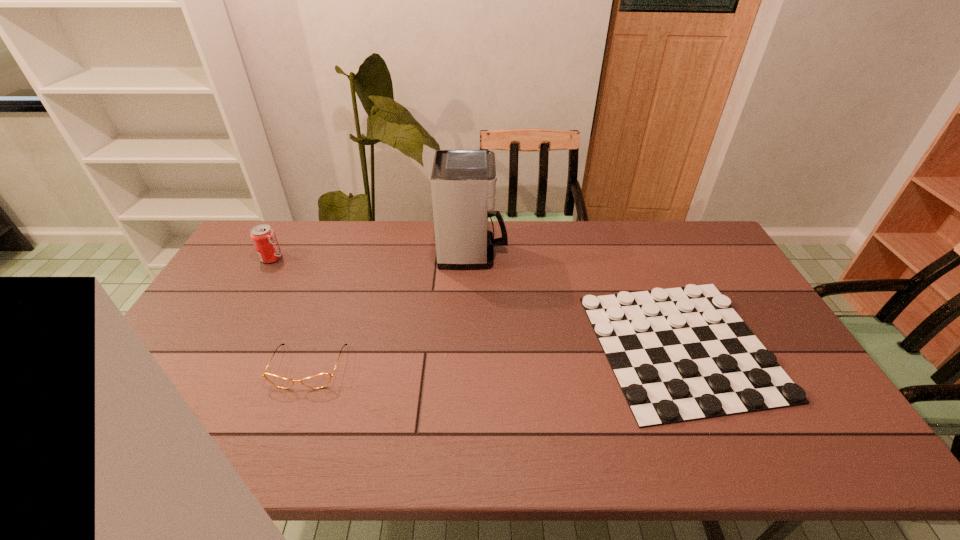
The height and width of the screenshot is (540, 960). I want to click on free location at the near edge, so click(x=367, y=436).

At what (x,y) coordinates should I click in order to perform the action: click on vacant point at the far left corner. Please return your answer as a coordinate pair (x, y). The image size is (960, 540). Looking at the image, I should click on click(251, 232).

The image size is (960, 540). In order to click on vacant space at the far right corner of the desktop in this screenshot , I will do `click(708, 252)`.

At what (x,y) coordinates should I click in order to perform the action: click on free location at the near right corner of the desktop. Please return your answer as a coordinate pair (x, y). This screenshot has width=960, height=540. Looking at the image, I should click on (780, 444).

Where is `free space between the third tallest object and the soda can`? The image size is (960, 540). free space between the third tallest object and the soda can is located at coordinates (290, 313).

At what (x,y) coordinates should I click in order to perform the action: click on free space between the third object from right to left and the rightmost object. Please return your answer as a coordinate pair (x, y). The height and width of the screenshot is (540, 960). Looking at the image, I should click on (494, 356).

Find the location of a particular element. The image size is (960, 540). vacant space that is in between the shortest object and the third object from right to left is located at coordinates (494, 356).

Locate an element on the screen. The width and height of the screenshot is (960, 540). free space that is in between the third shortest object and the third object from right to left is located at coordinates (290, 313).

Locate an element on the screen. The width and height of the screenshot is (960, 540). free space between the third object from left to right and the rightmost object is located at coordinates (577, 299).

This screenshot has height=540, width=960. I want to click on vacant area that lies between the second object from right to left and the spectacles, so click(391, 310).